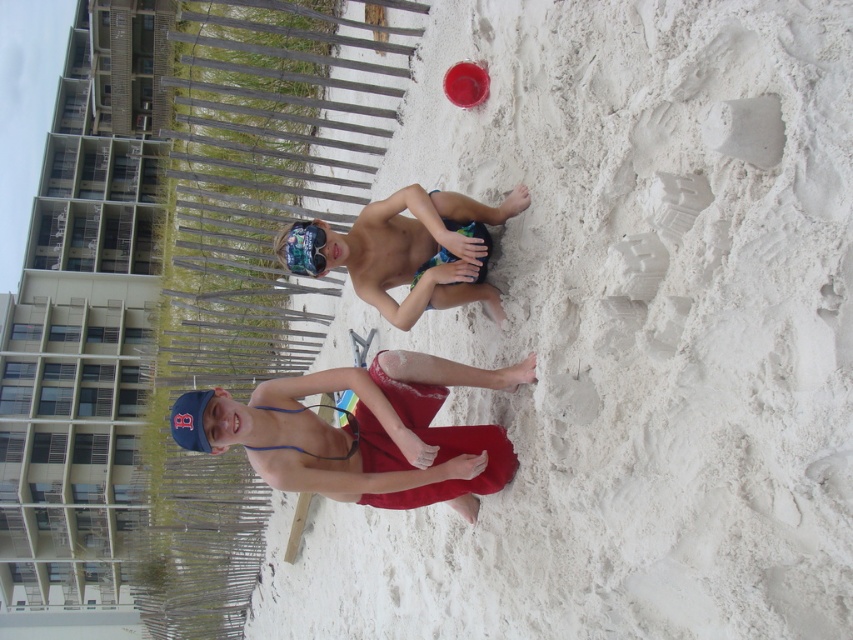
Looking at this image, between red fabric shorts at center and blue rubber goggles at center, which one is positioned higher?

blue rubber goggles at center is above.

The height and width of the screenshot is (640, 853). Describe the element at coordinates (363, 433) in the screenshot. I see `red fabric shorts at center` at that location.

Locate an element on the screen. This screenshot has width=853, height=640. red fabric shorts at center is located at coordinates (363, 433).

Is printed fabric shorts at center positioned behind blue rubber goggles at center?

No.

Between printed fabric shorts at center and blue rubber goggles at center, which one appears on the right side from the viewer's perspective?

From the viewer's perspective, printed fabric shorts at center appears more on the right side.

Is point (413, 289) positioned before point (299, 236)?

No.

This screenshot has height=640, width=853. What are the coordinates of `printed fabric shorts at center` in the screenshot? It's located at (407, 250).

Can you confirm if white sandy beach at center is taller than red fabric shorts at center?

Yes.

Who is positioned more to the left, white sandy beach at center or red fabric shorts at center?

red fabric shorts at center is more to the left.

This screenshot has height=640, width=853. Find the location of `white sandy beach at center`. white sandy beach at center is located at coordinates (624, 333).

At what (x,y) coordinates should I click in order to perform the action: click on white sandy beach at center. Please return your answer as a coordinate pair (x, y). The image size is (853, 640). Looking at the image, I should click on [x=624, y=333].